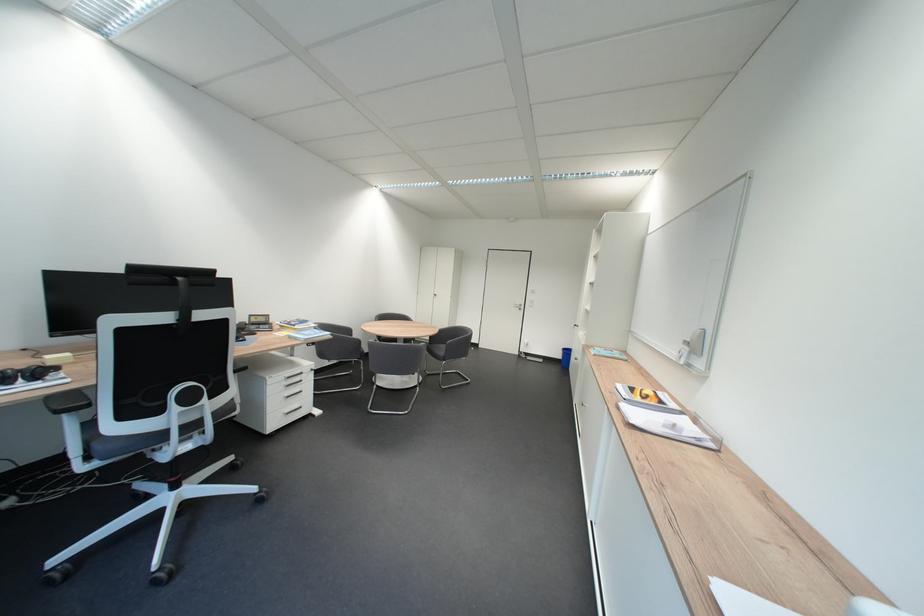
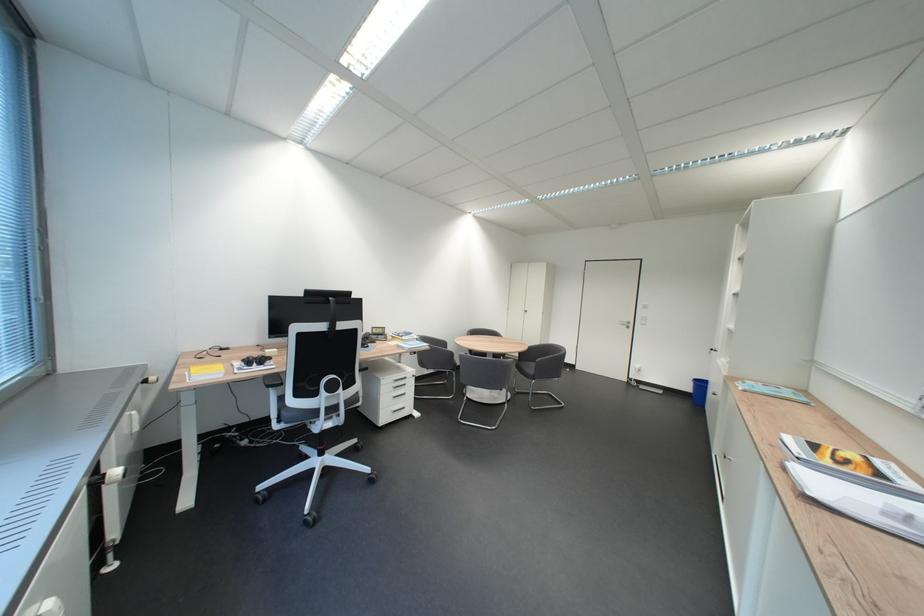
Question: The camera is either moving clockwise (left) or counter-clockwise (right) around the object. The first image is from the beginning of the video and the second image is from the end. Is the camera moving left or right when shooting the video?

Choices:
 (A) Left
 (B) Right

Answer: (B)